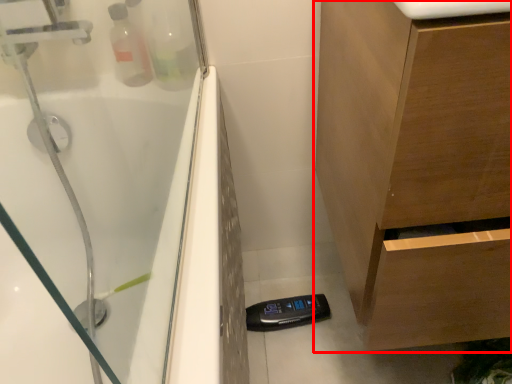
Question: Observing the image, what is the correct spatial positioning of bathroom cabinet (annotated by the red box) in reference to counter top?

Choices:
 (A) right
 (B) left

Answer: (A)